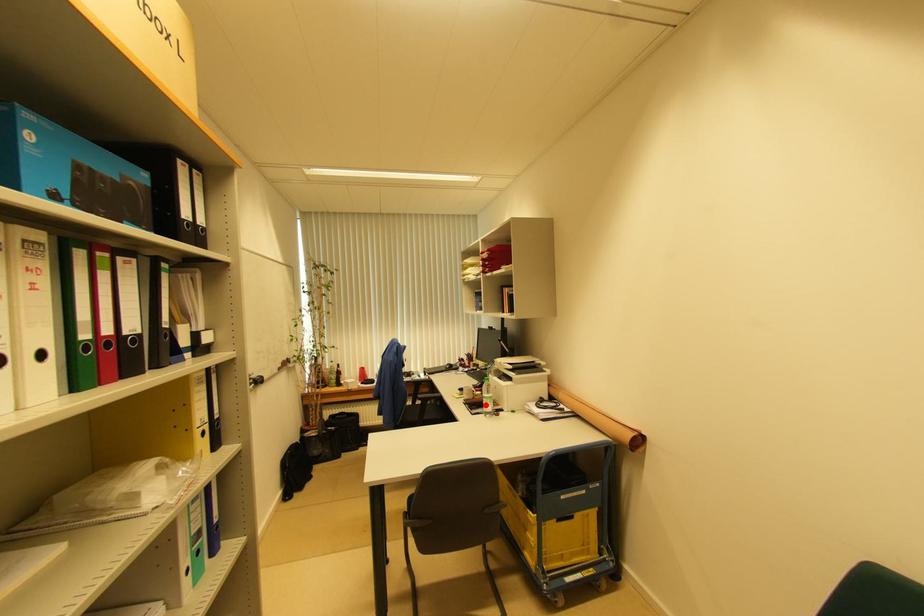
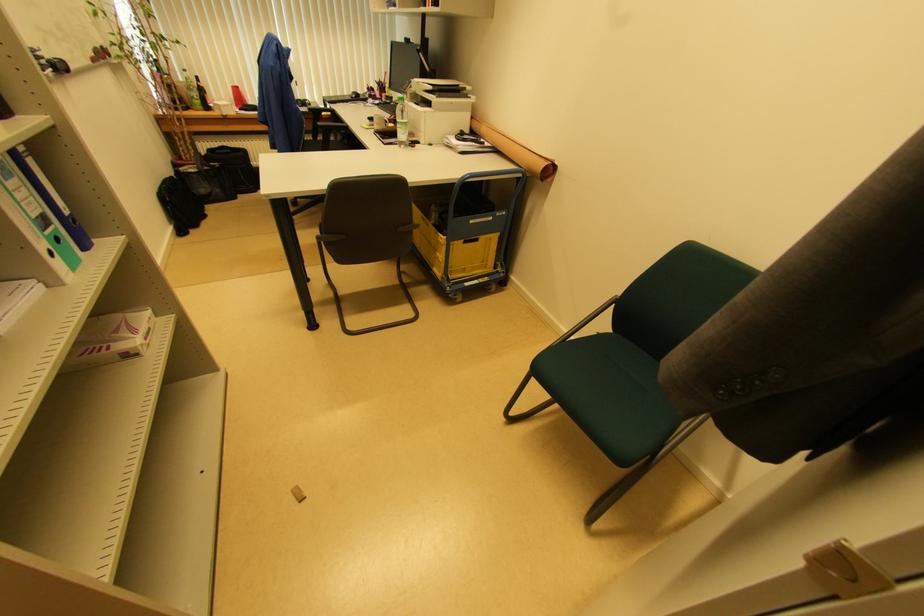
Question: I am providing you with two images of the same scene from different viewpoints. A red point is marked on the first image. Is the red point's position out of view in image 2?

Choices:
 (A) Yes
 (B) No

Answer: (B)